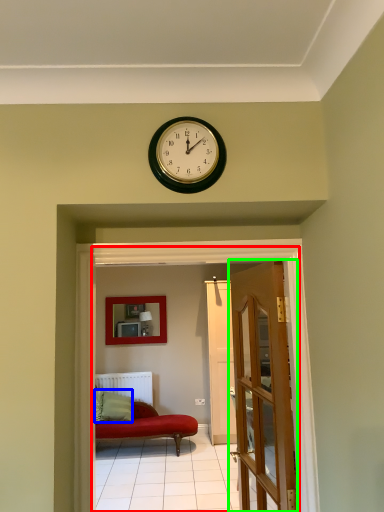
Question: Which object is the farthest from corridor (highlighted by a red box)? Choose among these: pillow (highlighted by a blue box) or door (highlighted by a green box).

Choices:
 (A) pillow
 (B) door

Answer: (A)